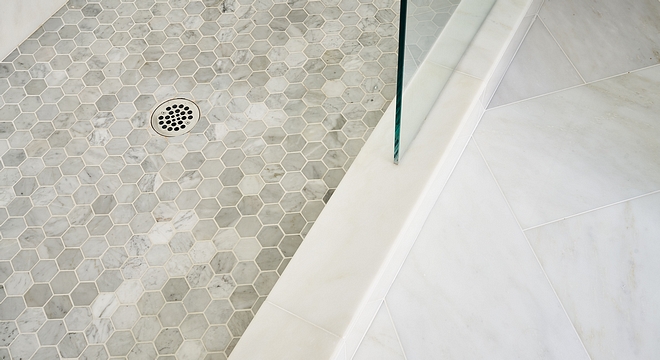
Find the location of a particular element. The image size is (660, 360). front of shower curb is located at coordinates 447,164.